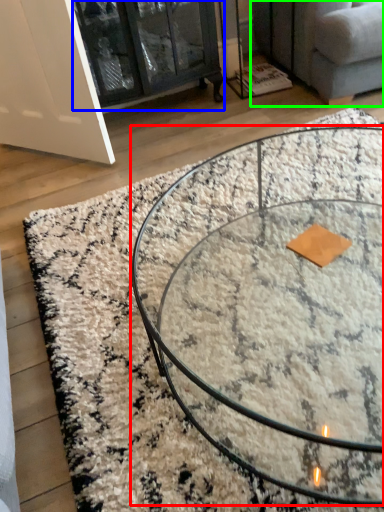
Question: Estimate the real-world distances between objects in this image. Which object is farther from coffee table (highlighted by a red box), glass door (highlighted by a blue box) or studio couch (highlighted by a green box)?

Choices:
 (A) glass door
 (B) studio couch

Answer: (A)